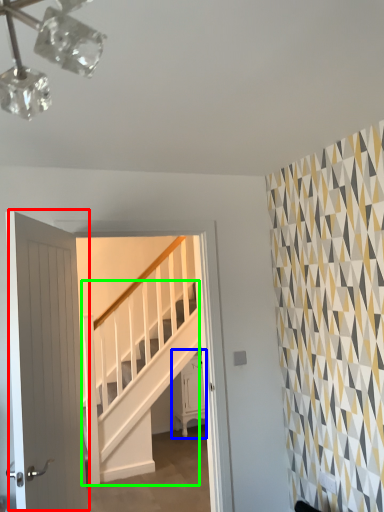
Question: Based on their relative distances, which object is nearer to door (highlighted by a red box)? Choose from furniture (highlighted by a blue box) and stairs (highlighted by a green box).

Choices:
 (A) furniture
 (B) stairs

Answer: (B)